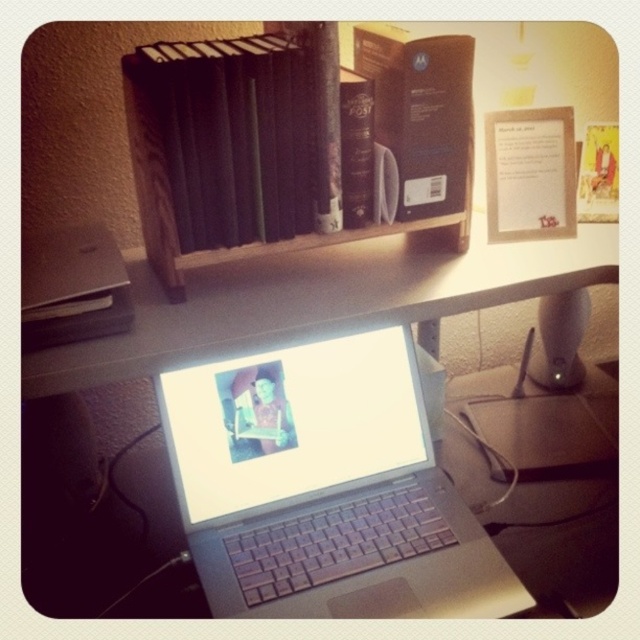
Question: Can you confirm if wooden bookshelf at upper center is smaller than silver metallic laptop at center?

Choices:
 (A) no
 (B) yes

Answer: (B)

Question: Which point is closer to the camera?

Choices:
 (A) (429, 240)
 (B) (134, 90)

Answer: (B)

Question: Observing the image, what is the correct spatial positioning of satin silver laptop at center in reference to wooden bookshelf at upper center?

Choices:
 (A) below
 (B) above

Answer: (A)

Question: Which is nearer to the silver metallic laptop at center?

Choices:
 (A) satin silver laptop at center
 (B) wooden bookshelf at upper center

Answer: (B)

Question: Among these points, which one is farthest from the camera?

Choices:
 (A) (364, 77)
 (B) (349, 545)

Answer: (B)

Question: Can you confirm if satin silver laptop at center is wider than wooden bookshelf at upper center?

Choices:
 (A) yes
 (B) no

Answer: (B)